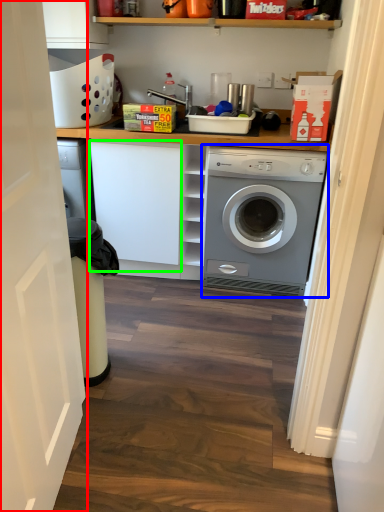
Question: Based on their relative distances, which object is nearer to door (highlighted by a red box)? Choose from washing machine (highlighted by a blue box) and cabinetry (highlighted by a green box).

Choices:
 (A) washing machine
 (B) cabinetry

Answer: (B)